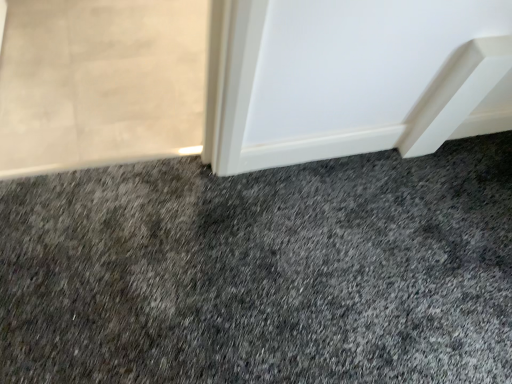
This screenshot has width=512, height=384. What do you see at coordinates (262, 272) in the screenshot? I see `dark gray carpet at center` at bounding box center [262, 272].

This screenshot has height=384, width=512. I want to click on dark gray carpet at center, so click(262, 272).

In order to face dark gray carpet at center, should I rotate leftwards or rightwards?

Turn right by 10.638 degrees to look at dark gray carpet at center.

Where is `translucent glass screen door at upper left`? translucent glass screen door at upper left is located at coordinates (100, 83).

What is the approximate width of translucent glass screen door at upper left?

It is 34.33 inches.

What do you see at coordinates (100, 83) in the screenshot?
I see `translucent glass screen door at upper left` at bounding box center [100, 83].

What are the coordinates of `dark gray carpet at center` in the screenshot? It's located at (262, 272).

Which is more to the right, dark gray carpet at center or translucent glass screen door at upper left?

dark gray carpet at center.

Which object is more forward, dark gray carpet at center or translucent glass screen door at upper left?

dark gray carpet at center is in front.

Which is closer to the camera, (70,258) or (146,1)?

The point (70,258) is in front.

Consider the image. From the image's perspective, is dark gray carpet at center positioned above or below translucent glass screen door at upper left?

Clearly, from the image's perspective, dark gray carpet at center is below translucent glass screen door at upper left.

From a real-world perspective, relative to translucent glass screen door at upper left, is dark gray carpet at center vertically above or below?

dark gray carpet at center is situated higher than translucent glass screen door at upper left in the real world.

Considering the sizes of objects dark gray carpet at center and translucent glass screen door at upper left in the image provided, who is wider, dark gray carpet at center or translucent glass screen door at upper left?

dark gray carpet at center is wider.

Looking at this image, who is shorter, dark gray carpet at center or translucent glass screen door at upper left?

dark gray carpet at center is shorter.

Considering the relative sizes of dark gray carpet at center and translucent glass screen door at upper left in the image provided, is dark gray carpet at center bigger than translucent glass screen door at upper left?

Yes.

Would you say dark gray carpet at center is outside translucent glass screen door at upper left?

Yes, dark gray carpet at center is not within translucent glass screen door at upper left.

Based on the photo, is dark gray carpet at center far from translucent glass screen door at upper left?

dark gray carpet at center is near translucent glass screen door at upper left, not far away.

Is dark gray carpet at center positioned with its back to translucent glass screen door at upper left?

No.

What's the angular difference between dark gray carpet at center and translucent glass screen door at upper left's facing directions?

180 degrees separate the facing orientations of dark gray carpet at center and translucent glass screen door at upper left.

Where is `granite on the right of translucent glass screen door at upper left`? Image resolution: width=512 pixels, height=384 pixels. granite on the right of translucent glass screen door at upper left is located at coordinates (262, 272).

Would you say translucent glass screen door at upper left is to the left or to the right of dark gray carpet at center in the picture?

In the image, translucent glass screen door at upper left appears on the left side of dark gray carpet at center.

Considering the relative positions of translucent glass screen door at upper left and dark gray carpet at center in the image provided, is translucent glass screen door at upper left in front of dark gray carpet at center?

No, translucent glass screen door at upper left is further to the viewer.

Does point (172, 77) come closer to viewer compared to point (460, 371)?

No.

From the image's perspective, which is below, translucent glass screen door at upper left or dark gray carpet at center?

dark gray carpet at center.

From a real-world perspective, which object stands above the other?

In real-world perspective, dark gray carpet at center is above.

Is translucent glass screen door at upper left wider or thinner than dark gray carpet at center?

In the image, translucent glass screen door at upper left appears to be more narrow than dark gray carpet at center.

Can you confirm if translucent glass screen door at upper left is shorter than dark gray carpet at center?

In fact, translucent glass screen door at upper left may be taller than dark gray carpet at center.

In the scene shown: Which of these two, translucent glass screen door at upper left or dark gray carpet at center, is smaller?

Smaller between the two is translucent glass screen door at upper left.

Could dark gray carpet at center be considered to be inside translucent glass screen door at upper left?

Definitely not — dark gray carpet at center is not inside translucent glass screen door at upper left.

Is translucent glass screen door at upper left positioned far away from dark gray carpet at center?

No, translucent glass screen door at upper left is not far away from dark gray carpet at center.

Is translucent glass screen door at upper left positioned with its back to dark gray carpet at center?

No, translucent glass screen door at upper left's orientation is not away from dark gray carpet at center.

Identify the location of granite in front of the translucent glass screen door at upper left. (262, 272).

Locate an element on the screen. This screenshot has width=512, height=384. screen door located underneath the dark gray carpet at center (from a real-world perspective) is located at coordinates (100, 83).

The width and height of the screenshot is (512, 384). I want to click on screen door behind the dark gray carpet at center, so click(x=100, y=83).